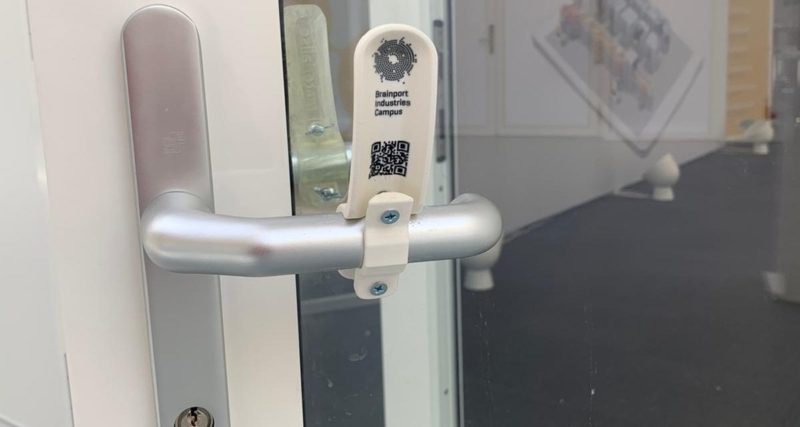
The width and height of the screenshot is (800, 427). Identify the location of lock. (188, 416).